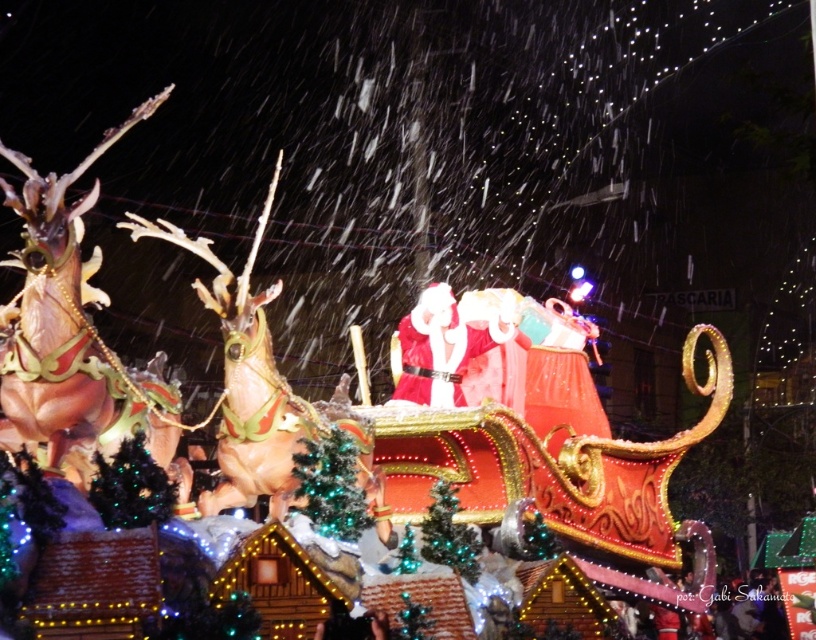
You are a photographer trying to capture the festive Christmas float from the front. You notice two points marked on your camera screen at coordinates point (50, 406) and point (451, 509). Which point should you focus on to ensure it appears closer in the photo?

Point (50, 406) is closer to the camera than point (451, 509), so focusing on point (50, 406) will make it appear closer in the photo.

You are a photographer trying to capture both the velvet red santa at center and the green glittering christmas tree at center in a single frame. Based on their sizes, will you need to adjust your camera angle to include both?

The velvet red santa at center might be wider than the green glittering christmas tree at center, so adjusting the camera angle might be necessary to ensure both are fully visible in the frame.